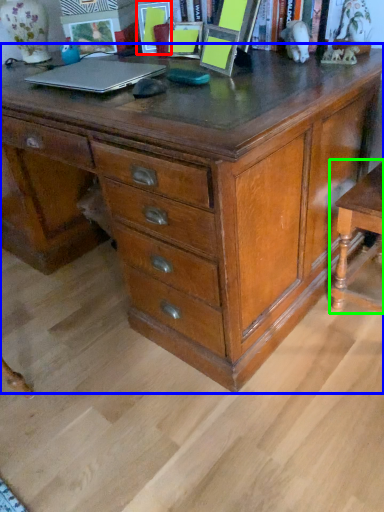
Question: Which is farther away from picture frame (highlighted by a red box)? chest of drawers (highlighted by a blue box) or table (highlighted by a green box)?

Choices:
 (A) chest of drawers
 (B) table

Answer: (B)